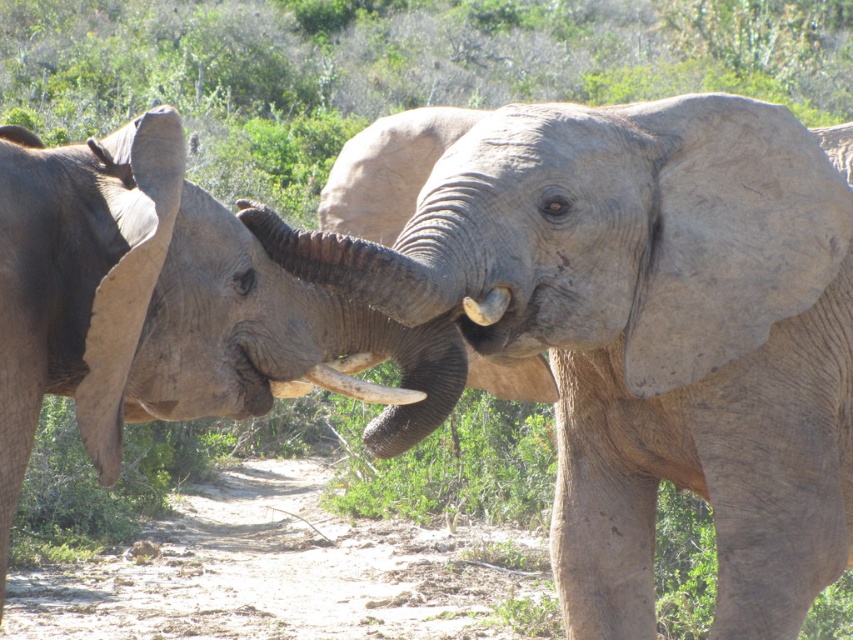
Is gray rough skin elephant at center below white ivory tusk at center?

Incorrect, gray rough skin elephant at center is not positioned below white ivory tusk at center.

Measure the distance between gray rough skin elephant at center and camera.

The distance of gray rough skin elephant at center from camera is 8.00 feet.

Is point (747, 477) farther from viewer compared to point (347, 385)?

That is True.

Where is `gray rough skin elephant at center`? The height and width of the screenshot is (640, 853). gray rough skin elephant at center is located at coordinates (648, 332).

Can you confirm if gray rough skin elephant at center is positioned to the left of gray textured baby elephant at left?

In fact, gray rough skin elephant at center is to the right of gray textured baby elephant at left.

Is the position of gray rough skin elephant at center less distant than that of gray textured baby elephant at left?

That is False.

Which is in front, point (718, 371) or point (321, 300)?

Point (321, 300) is in front.

This screenshot has width=853, height=640. What are the coordinates of `gray rough skin elephant at center` in the screenshot? It's located at (648, 332).

Which is in front, point (395, 340) or point (399, 388)?

Point (399, 388)

Does gray textured baby elephant at left have a greater height compared to white ivory tusk at center?

Indeed, gray textured baby elephant at left has a greater height compared to white ivory tusk at center.

Is point (93, 323) in front of point (390, 400)?

Yes, it is in front of point (390, 400).

At what (x,y) coordinates should I click in order to perform the action: click on gray textured baby elephant at left. Please return your answer as a coordinate pair (x, y). The width and height of the screenshot is (853, 640). Looking at the image, I should click on (167, 307).